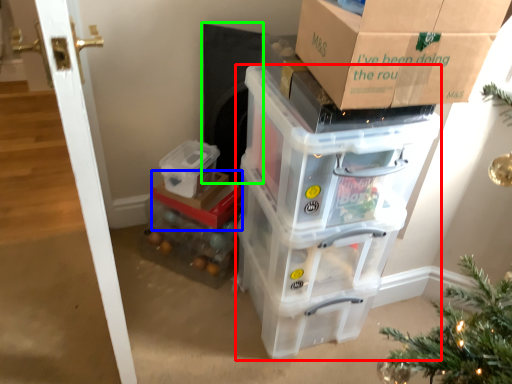
Question: Estimate the real-world distances between objects in this image. Which object is closer to storage box (highlighted by a red box), storage box (highlighted by a blue box) or appliance (highlighted by a green box)?

Choices:
 (A) storage box
 (B) appliance

Answer: (A)